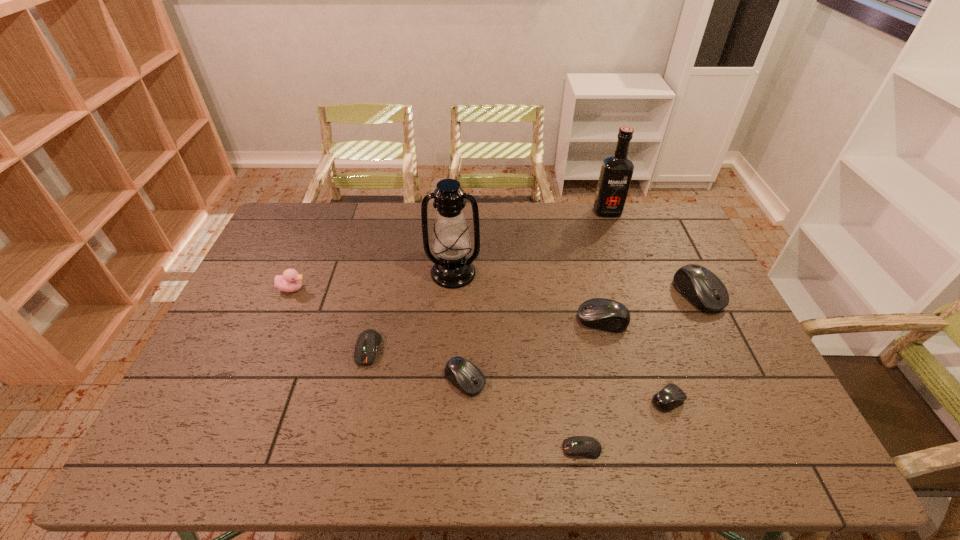
Locate an element on the screen. the fourth closest computer equipment relative to the nearer dark computer equipment is located at coordinates (701, 287).

Select which black mouse is the third closest to the tallest computer equipment. Please provide its 2D coordinates. Your answer should be formatted as a tuple, i.e. [(x, y)], where the tuple contains the x and y coordinates of a point satisfying the conditions above.

[(468, 378)]

Select which black mouse appears as the second closest to the duckling. Please provide its 2D coordinates. Your answer should be formatted as a tuple, i.e. [(x, y)], where the tuple contains the x and y coordinates of a point satisfying the conditions above.

[(604, 314)]

At what (x,y) coordinates should I click in order to perform the action: click on vacant region that satisfies the following two spatial constraints: 1. on the front-facing side of the rightmost computer equipment; 2. on the left side of the leftmost object. Please return your answer as a coordinate pair (x, y). The image size is (960, 540). Looking at the image, I should click on (290, 294).

Find the location of a particular element. The image size is (960, 540). blank space that satisfies the following two spatial constraints: 1. on the front-facing side of the leftmost object; 2. on the back side of the smallest black mouse is located at coordinates (245, 400).

You are a GUI agent. You are given a task and a screenshot of the screen. Output one action in this format:
    pyautogui.click(x=<x>, y=<y>)
    Task: Click on the vacant position in the image that satisfies the following two spatial constraints: 1. on the button of the left dark computer equipment; 2. on the right side of the third biggest black mouse
    The width and height of the screenshot is (960, 540).
    Given the screenshot: What is the action you would take?
    pyautogui.click(x=361, y=380)

Identify the location of blank space that satisfies the following two spatial constraints: 1. on the front-facing side of the farthest object; 2. on the button of the nearest object. (690, 449).